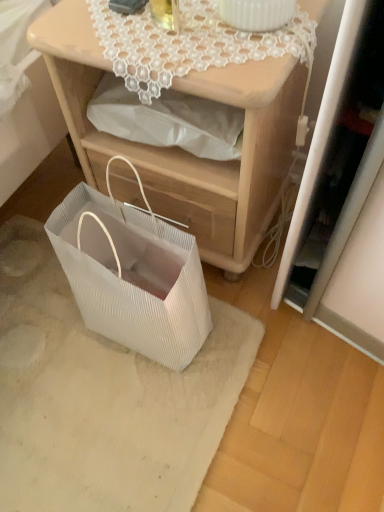
Find the location of a particular element. This screenshot has height=512, width=384. blank area beneath white textured mat at lower left (from a real-world perspective) is located at coordinates (x=65, y=371).